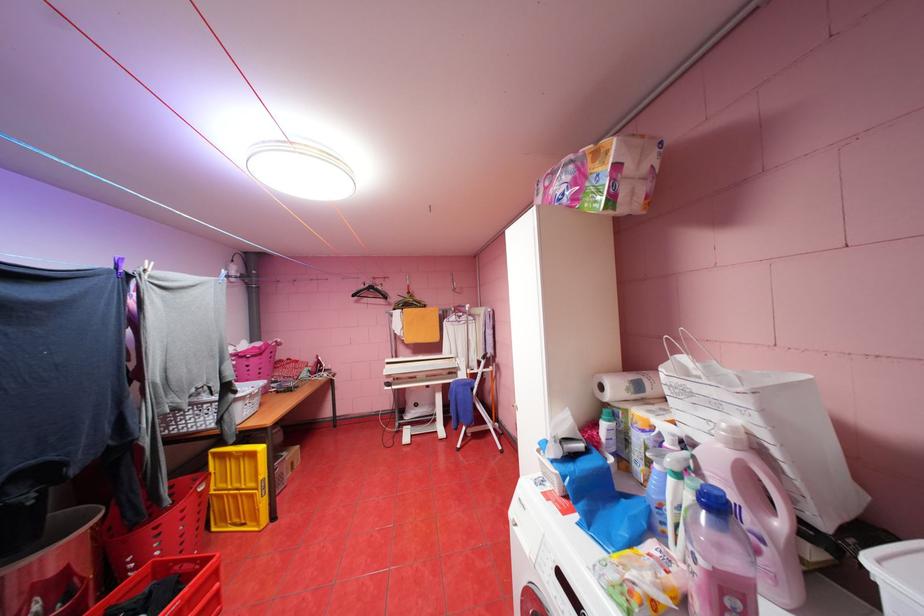
The location [237,488] corresponds to which object?

This point indicates the yellow plastic crate.